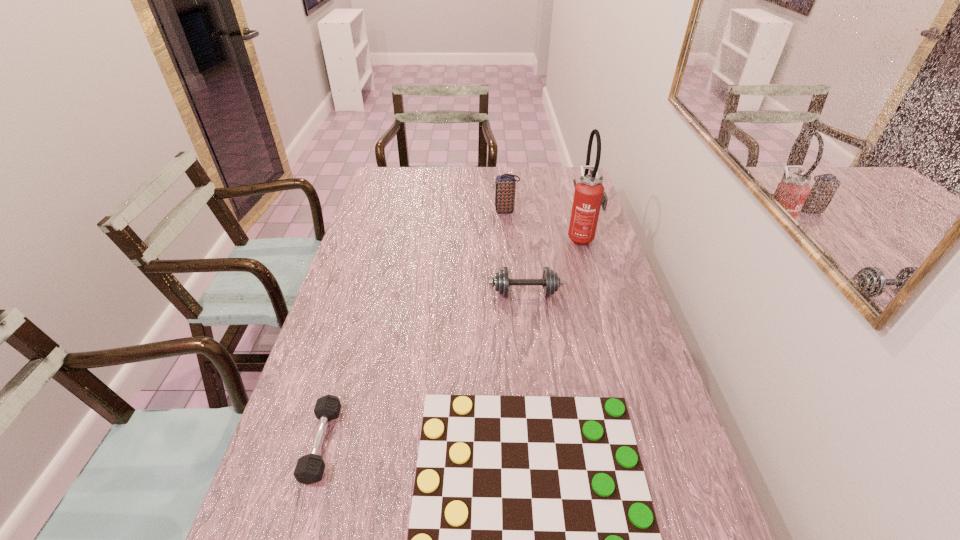
Where is `the fourth nearest object`? the fourth nearest object is located at coordinates (589, 196).

The image size is (960, 540). In order to click on fire extinguisher in this screenshot , I will do `click(589, 196)`.

This screenshot has height=540, width=960. I want to click on the fourth shortest object, so click(x=504, y=184).

The width and height of the screenshot is (960, 540). In order to click on the farthest object in this screenshot , I will do `click(504, 184)`.

Where is `the farther dumbbell`? the farther dumbbell is located at coordinates (550, 281).

The image size is (960, 540). What are the coordinates of `the taller dumbbell` in the screenshot? It's located at (550, 281).

Image resolution: width=960 pixels, height=540 pixels. Find the location of `the fourth tallest object`. the fourth tallest object is located at coordinates [x=309, y=469].

Locate an element on the screen. This screenshot has height=540, width=960. the nearer dumbbell is located at coordinates (309, 469).

Where is `free space located 0.310m at the nozzle of the second farthest object`? free space located 0.310m at the nozzle of the second farthest object is located at coordinates (480, 237).

I want to click on vacant area situated at the nozzle of the second farthest object, so pyautogui.click(x=469, y=237).